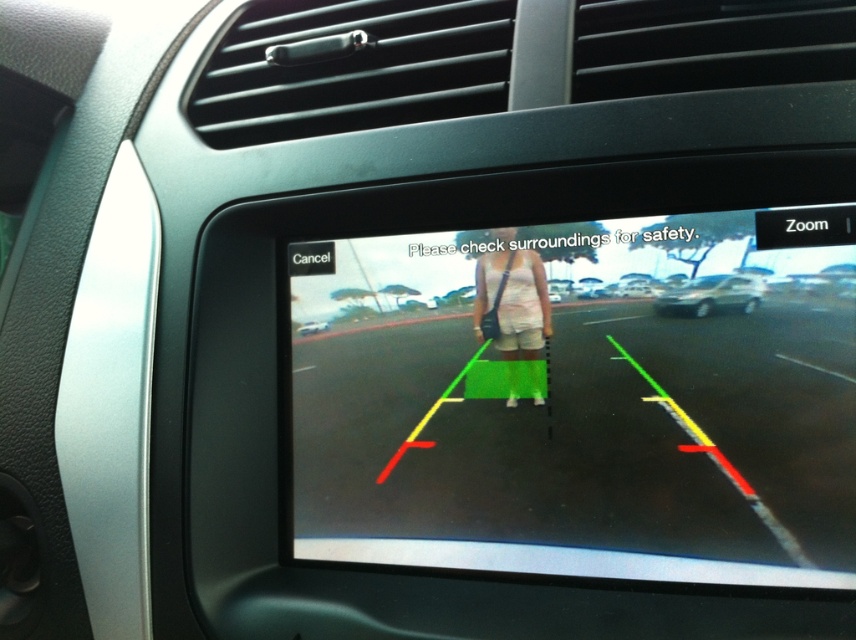
Is point (642, 280) closer to camera compared to point (541, 344)?

Yes, point (642, 280) is in front of point (541, 344).

Identify the location of matte black display at center. The image size is (856, 640). (581, 403).

Measure the distance between matte black display at center and white glossy car at center.

A distance of 14.49 inches exists between matte black display at center and white glossy car at center.

How far apart are matte black display at center and white glossy car at center?

matte black display at center and white glossy car at center are 14.49 inches apart from each other.

The image size is (856, 640). Describe the element at coordinates (581, 403) in the screenshot. I see `matte black display at center` at that location.

You are a GUI agent. You are given a task and a screenshot of the screen. Output one action in this format:
    pyautogui.click(x=<x>, y=<y>)
    Task: Click on the matte black display at center
    This screenshot has width=856, height=640.
    Given the screenshot: What is the action you would take?
    pyautogui.click(x=581, y=403)

How far apart are white cotton shorts at center and white glossy car at center?

The distance of white cotton shorts at center from white glossy car at center is 10.77 inches.

Is white cotton shorts at center to the left of white glossy car at center from the viewer's perspective?

In fact, white cotton shorts at center is to the right of white glossy car at center.

Which is behind, point (521, 289) or point (302, 330)?

The point (302, 330) is behind.

Identify the location of white cotton shorts at center. The height and width of the screenshot is (640, 856). (513, 307).